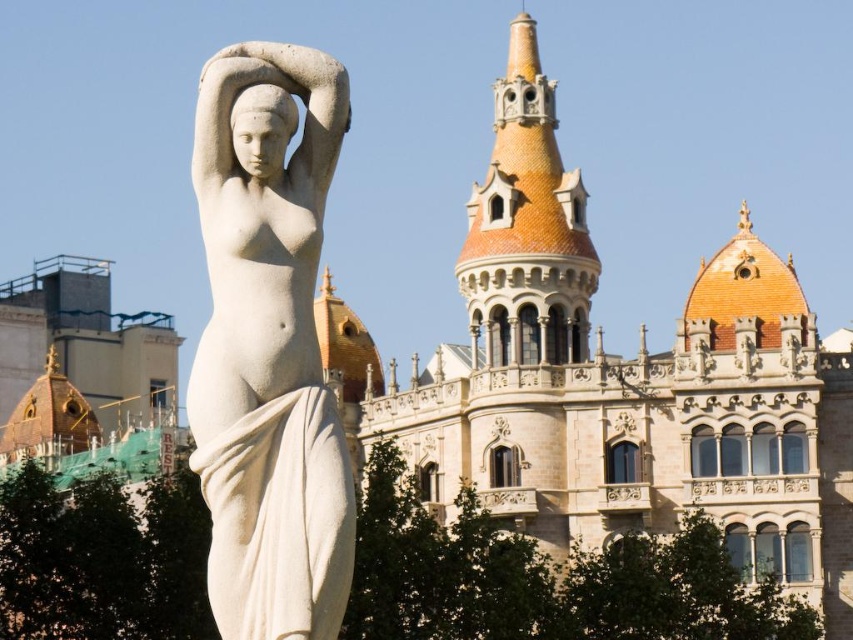
You are an art student who wants to sketch the scene. You notice the white marble statue at center and the terracotta tiled tower at upper center. Which object should you focus on first if you want to draw the bigger one?

The white marble statue at center has a larger size compared to the terracotta tiled tower at upper center, so you should focus on drawing the white marble statue at center first.

You are standing in front of the statue and want to place two markers on the ground at the coordinates point [234,436] and point [495,184]. Which marker will be closer to the statue?

Point [234,436] is in front of point [495,184], so the marker at point [234,436] will be closer to the statue.

You are an architect visiting a historical site. You notice the brown stone palace at center and the white marble statue at center. Which one would you say is larger in size?

The brown stone palace at center is bigger than the white marble statue at center.